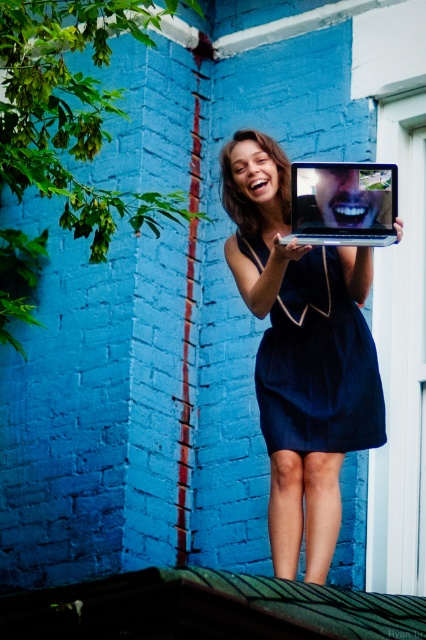
From the picture: You are trying to determine if the shiny silver laptop at center can fit into a box that is the same height as the dark blue fabric dress at center. Based on the scene, will the laptop fit vertically?

The shiny silver laptop at center is much taller than the dark blue fabric dress at center, so it will not fit into a box with the same height as the dress.

You are taking a photo of the shiny silver laptop at center and the dark blue fabric dress at center. Which object should you focus on first to ensure both are in sharp focus?

You should focus on the shiny silver laptop at center first since it is closer to the viewer than the dark blue fabric dress at center, allowing the dress to fall within the depth of field.

You are standing in front of the blue brick wall and want to place two markers at the specified coordinates. If you draw a straight line between point (331, 333) and point (356, 176), which point will be closer to the wall?

Point (356, 176) is closer to the wall because it is in front of point (331, 333), which is behind it.